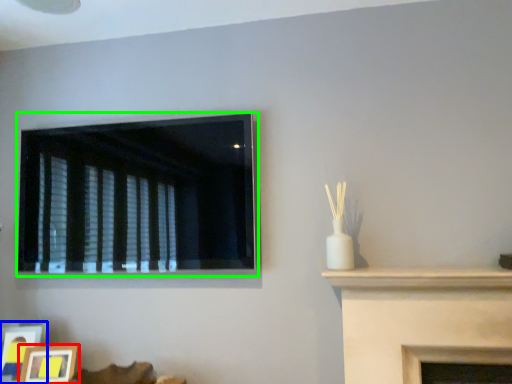
Question: Estimate the real-world distances between objects in this image. Which object is closer to picture frame (highlighted by a red box), picture frame (highlighted by a blue box) or window (highlighted by a green box)?

Choices:
 (A) picture frame
 (B) window

Answer: (A)